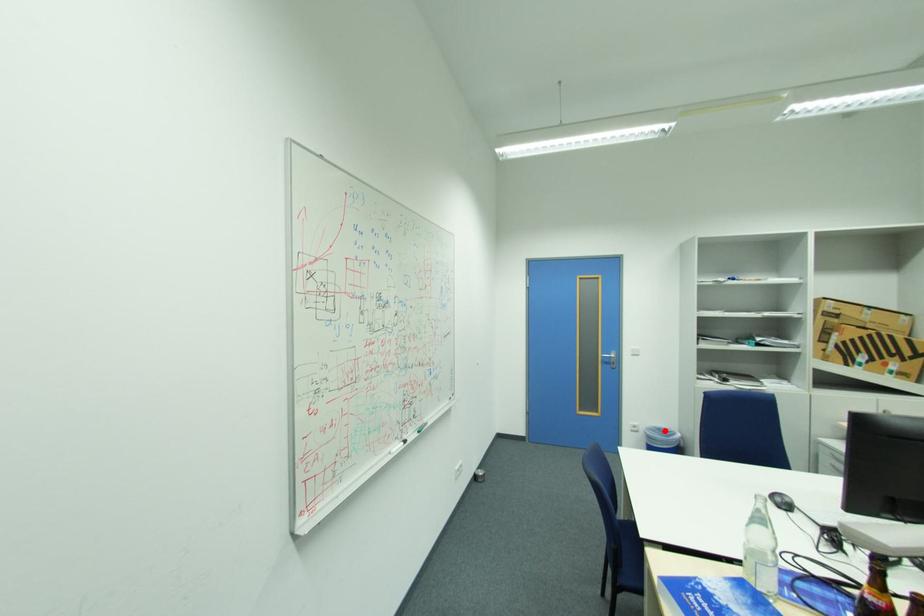
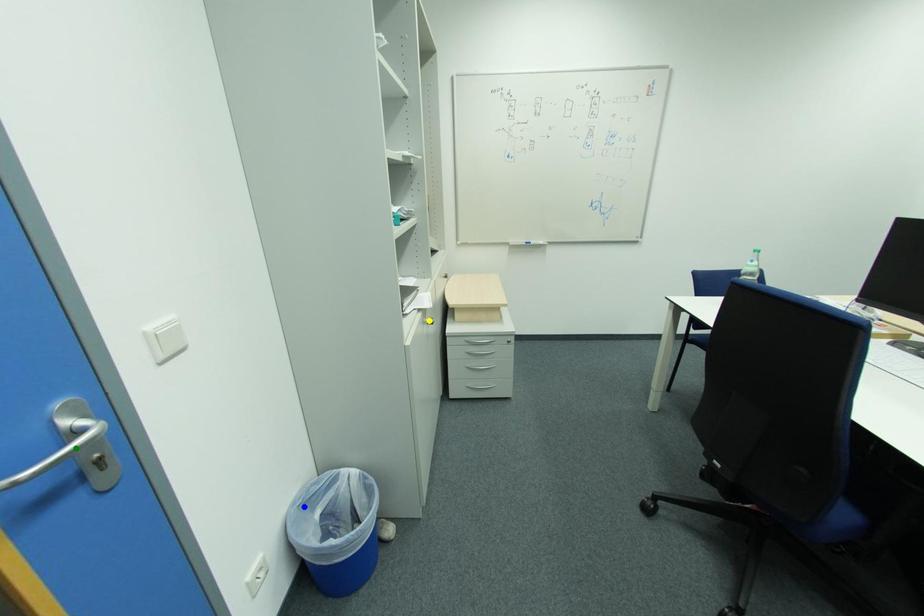
Question: I am providing you with two images of the same scene from different viewpoints. A red point is marked on the first image. You are given multiple points on the second image. In image 2, which mark is for the same physical point as the one in image 1?

Choices:
 (A) yellow point
 (B) green point
 (C) blue point

Answer: (C)